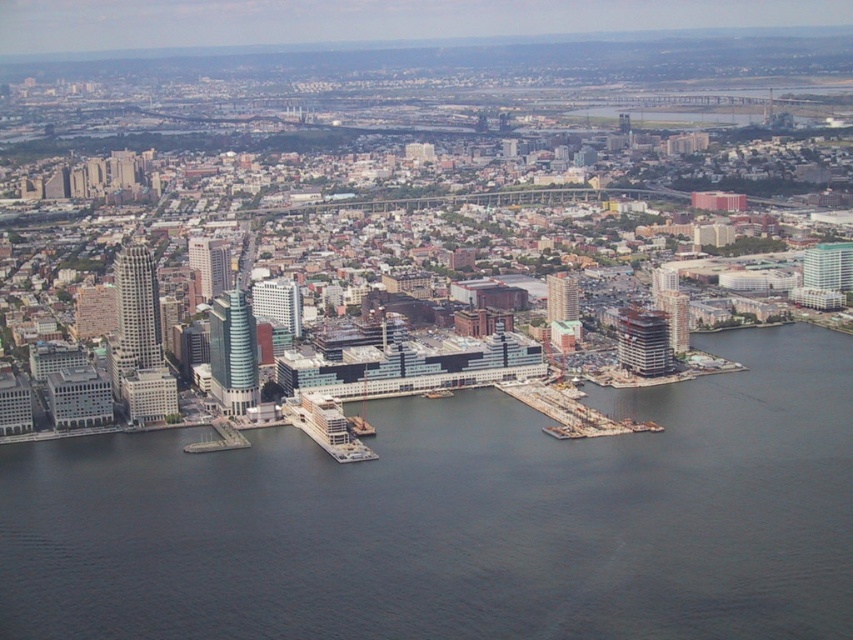
Question: In this image, where is wooden planks dock at lower right located relative to concrete dock at lower left?

Choices:
 (A) left
 (B) right

Answer: (B)

Question: Is wooden planks dock at lower right below concrete dock at lower left?

Choices:
 (A) no
 (B) yes

Answer: (A)

Question: Among these points, which one is nearest to the camera?

Choices:
 (A) (444, 627)
 (B) (219, 424)

Answer: (A)

Question: Which of the following is the farthest from the observer?

Choices:
 (A) wooden planks dock at lower right
 (B) dark blue water at center

Answer: (A)

Question: Observing the image, what is the correct spatial positioning of wooden planks dock at lower right in reference to concrete dock at lower left?

Choices:
 (A) left
 (B) right

Answer: (B)

Question: Which point appears farthest from the camera in this image?

Choices:
 (A) (561, 419)
 (B) (225, 445)

Answer: (B)